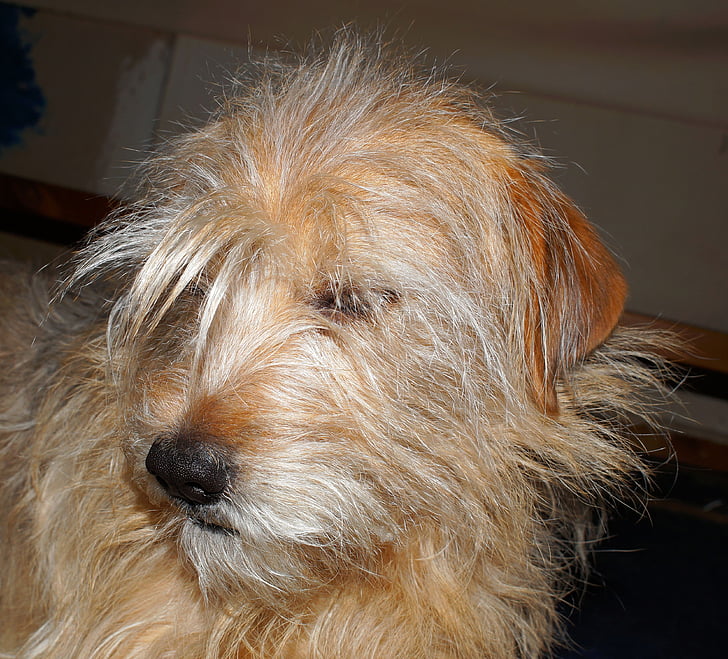
I want to click on floor, so click(649, 602).